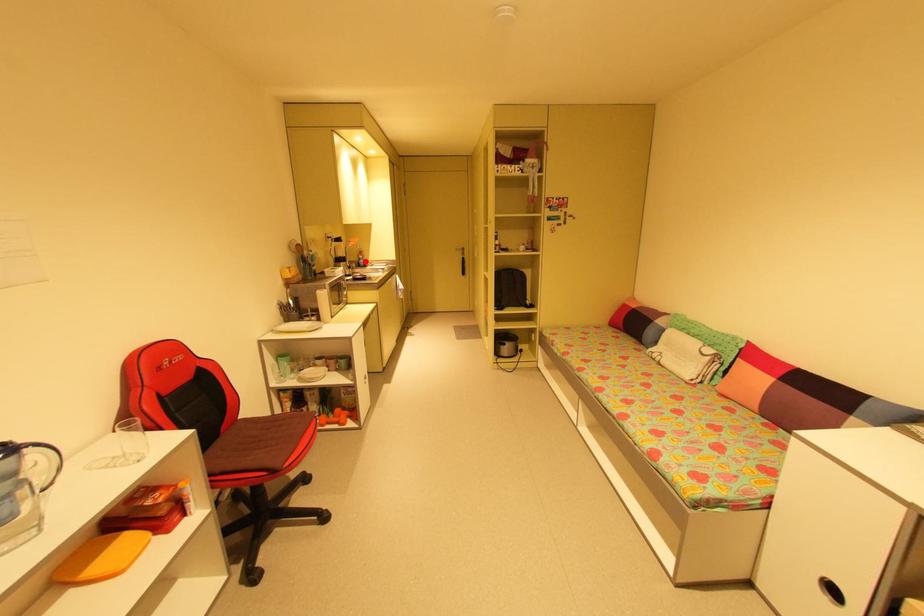
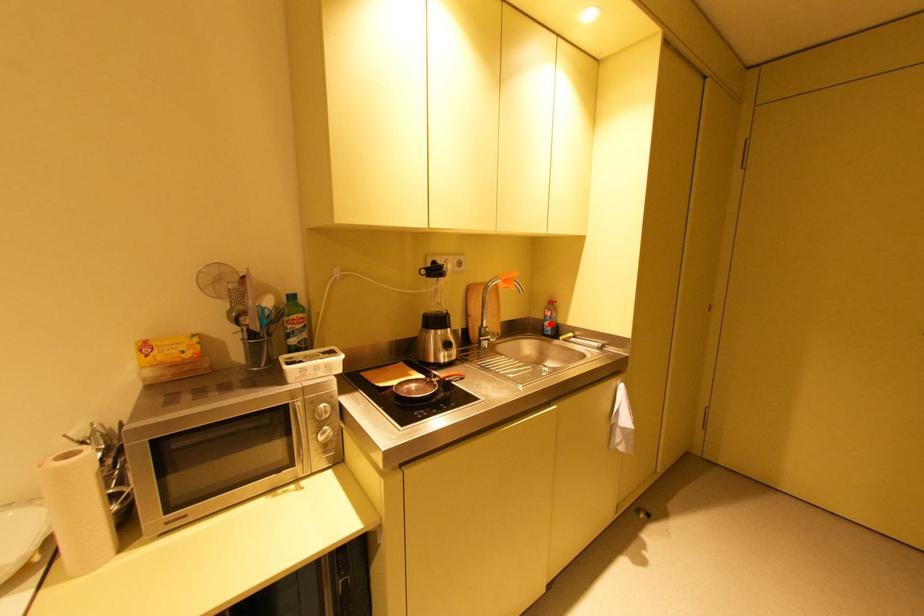
I am providing you with two images of the same scene from different viewpoints. A red point is marked on the first image and another point is marked on the second image. Does the point marked in image1 correspond to the same location as the one in image2?

Yes